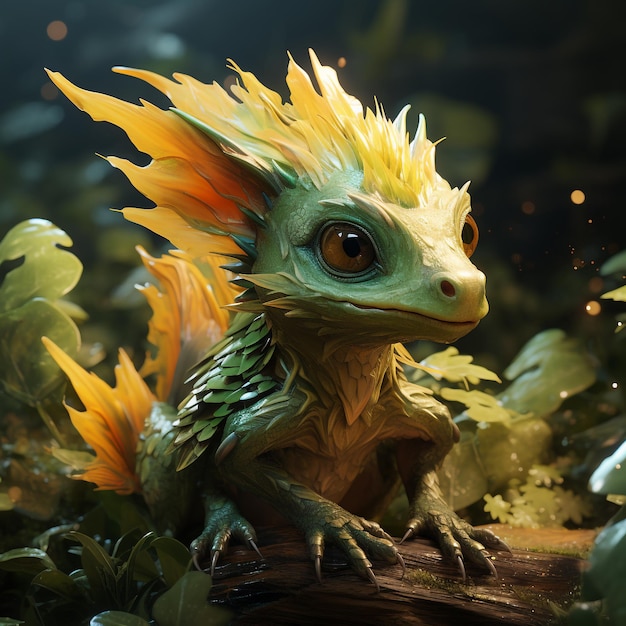
This screenshot has width=626, height=626. I want to click on chest, so click(x=330, y=429).